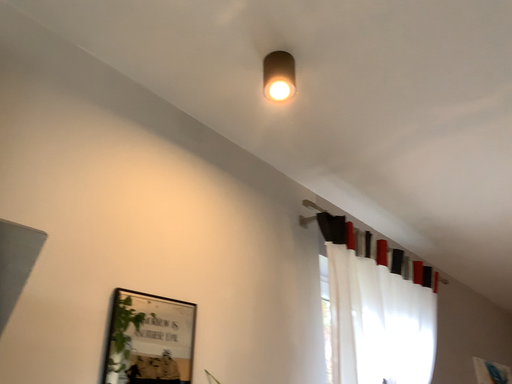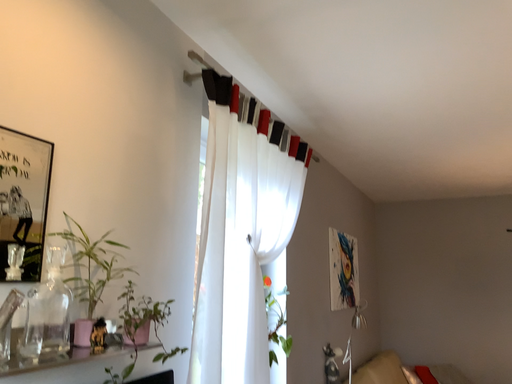
Question: How did the camera likely rotate when shooting the video?

Choices:
 (A) rotated downward
 (B) rotated upward

Answer: (A)